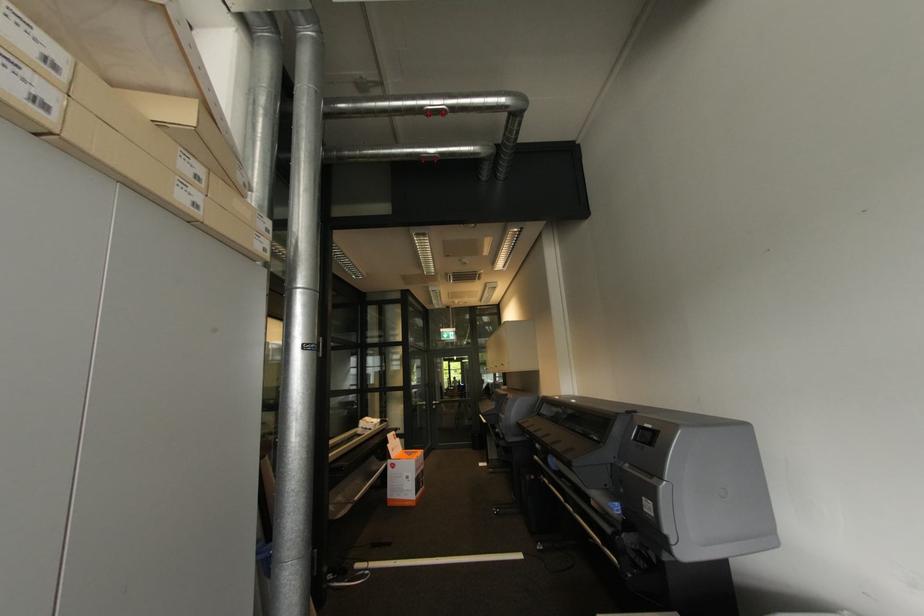
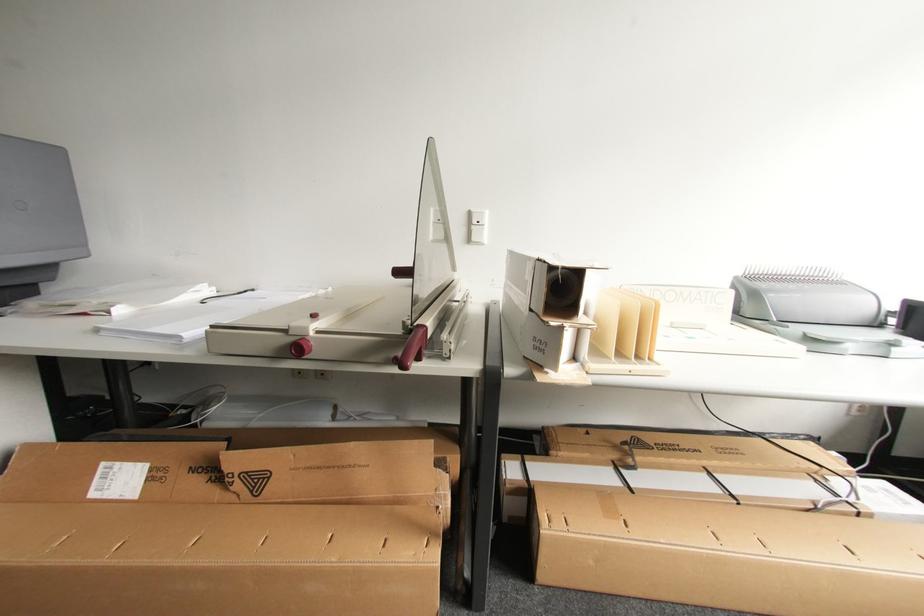
Question: The camera is either moving clockwise (left) or counter-clockwise (right) around the object. The first image is from the beginning of the video and the second image is from the end. Is the camera moving left or right when shooting the video?

Choices:
 (A) Left
 (B) Right

Answer: (A)